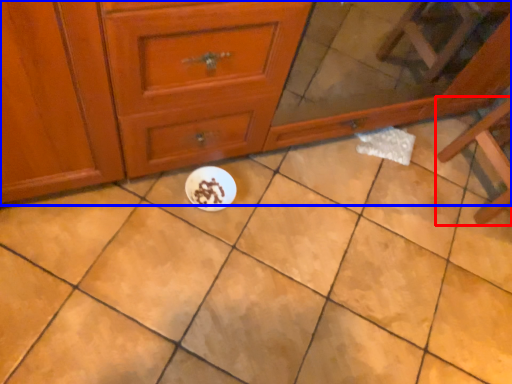
Question: Among these objects, which one is nearest to the camera, furniture (highlighted by a red box) or chest of drawers (highlighted by a blue box)?

Choices:
 (A) furniture
 (B) chest of drawers

Answer: (B)